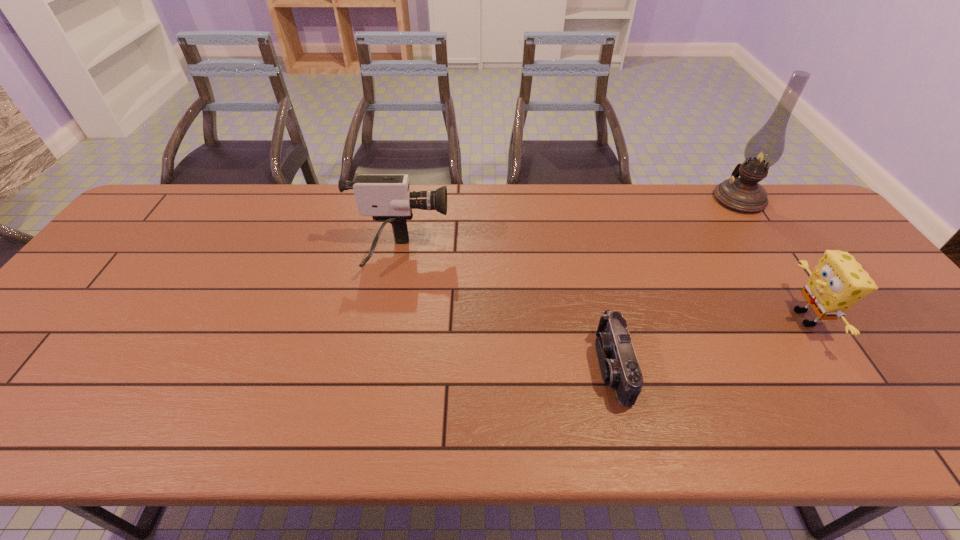
Locate an element on the screen. This screenshot has height=540, width=960. the farthest object is located at coordinates (743, 194).

This screenshot has height=540, width=960. What are the coordinates of `oil lamp` in the screenshot? It's located at (743, 194).

The image size is (960, 540). I want to click on the third shortest object, so pos(387,198).

Identify the location of the taller camcorder. The image size is (960, 540). (387, 198).

The height and width of the screenshot is (540, 960). Find the location of `sponge`. sponge is located at coordinates (838, 281).

Locate an element on the screen. The height and width of the screenshot is (540, 960). the shortest object is located at coordinates point(619,366).

Find the location of a particular element. The height and width of the screenshot is (540, 960). the nearer camcorder is located at coordinates (619, 366).

Where is `vacant space positioned 0.080m on the left of the farthest object`? vacant space positioned 0.080m on the left of the farthest object is located at coordinates (689, 199).

The width and height of the screenshot is (960, 540). In order to click on vacant space located 0.270m on the recording direction of the third shortest object in this screenshot , I will do `click(543, 255)`.

Find the location of `blank space located 0.290m on the face of the second shortest object`. blank space located 0.290m on the face of the second shortest object is located at coordinates (672, 318).